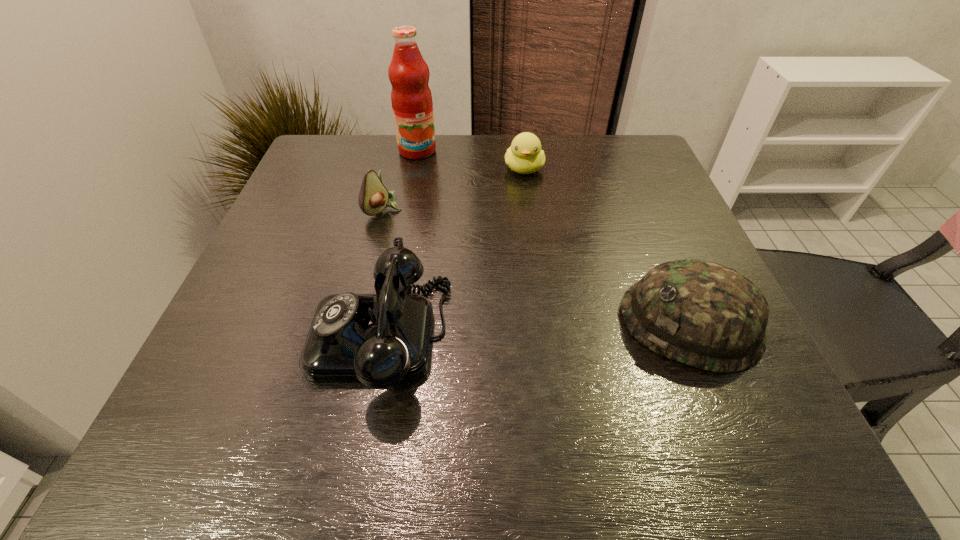
At what (x,y) coordinates should I click in order to perform the action: click on telephone positioned at the near edge. Please return your answer as a coordinate pair (x, y). Looking at the image, I should click on (380, 339).

Where is `headwear situated at the near edge`? This screenshot has height=540, width=960. headwear situated at the near edge is located at coordinates (703, 314).

Image resolution: width=960 pixels, height=540 pixels. Find the location of `object that is at the right edge`. object that is at the right edge is located at coordinates (703, 314).

The width and height of the screenshot is (960, 540). I want to click on object at the near right corner, so click(703, 314).

You are a GUI agent. You are given a task and a screenshot of the screen. Output one action in this format:
    pyautogui.click(x=<x>, y=<y>)
    Task: Click on the vacant space at the far edge
    
    Given the screenshot: What is the action you would take?
    pyautogui.click(x=478, y=174)

Where is `free point at the near edge`? This screenshot has height=540, width=960. free point at the near edge is located at coordinates (581, 361).

In the image, there is a desktop. Identify the location of free space at the left edge. (299, 218).

Locate an element on the screen. free space at the far left corner of the desktop is located at coordinates (331, 170).

The width and height of the screenshot is (960, 540). In the image, there is a desktop. What are the coordinates of `free space at the near left corner` in the screenshot? It's located at (278, 385).

Locate an element on the screen. The height and width of the screenshot is (540, 960). vacant space at the far right corner of the desktop is located at coordinates (644, 182).